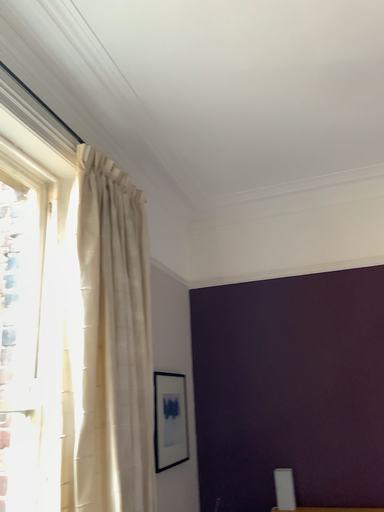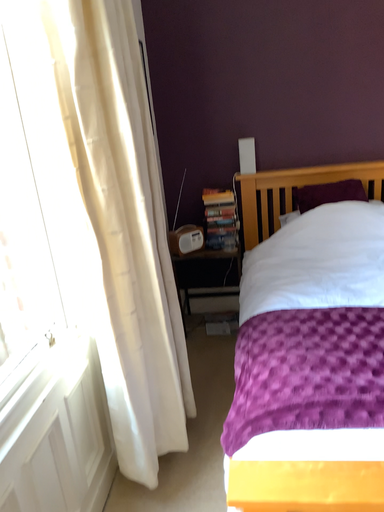
Question: Which way did the camera rotate in the video?

Choices:
 (A) rotated upward
 (B) rotated downward

Answer: (B)